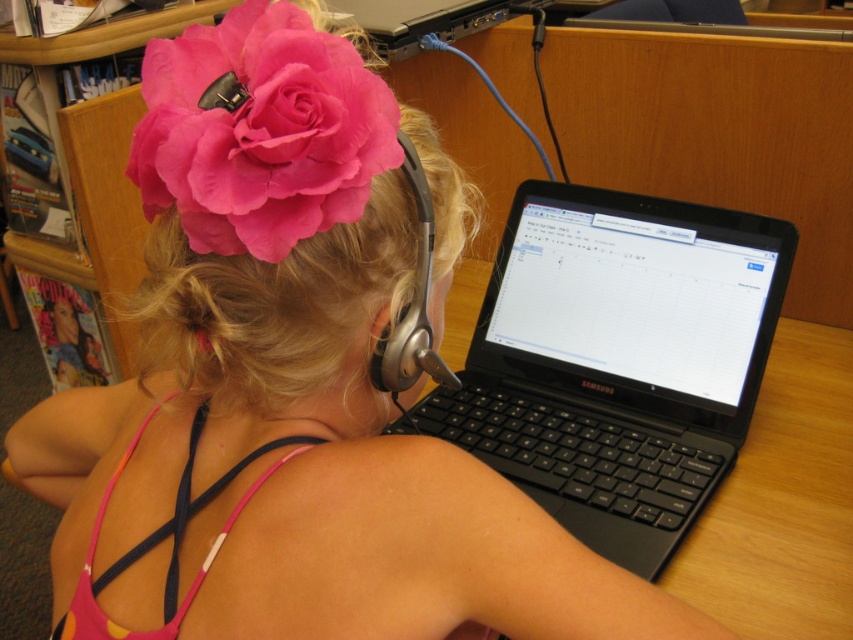
Question: Which point is closer to the camera?

Choices:
 (A) satin silver earphone at upper center
 (B) pink fabric bikini top at back
 (C) black plastic laptop at center
 (D) pink fabric flower at upper center

Answer: (D)

Question: Which point is closer to the camera?

Choices:
 (A) matte pink fabric flower at upper left
 (B) pink fabric bikini top at back
 (C) pink fabric flower at upper center
 (D) satin silver earphone at upper center

Answer: (A)

Question: Can you confirm if black plastic laptop at center is positioned to the left of matte pink fabric flower at upper left?

Choices:
 (A) yes
 (B) no

Answer: (B)

Question: Is pink fabric flower at upper center bigger than satin silver earphone at upper center?

Choices:
 (A) yes
 (B) no

Answer: (A)

Question: Which point is closer to the camera taking this photo?

Choices:
 (A) click(x=421, y=324)
 (B) click(x=547, y=253)

Answer: (A)

Question: Where is black plastic laptop at center located in relation to matte pink fabric flower at upper left in the image?

Choices:
 (A) left
 (B) right

Answer: (B)